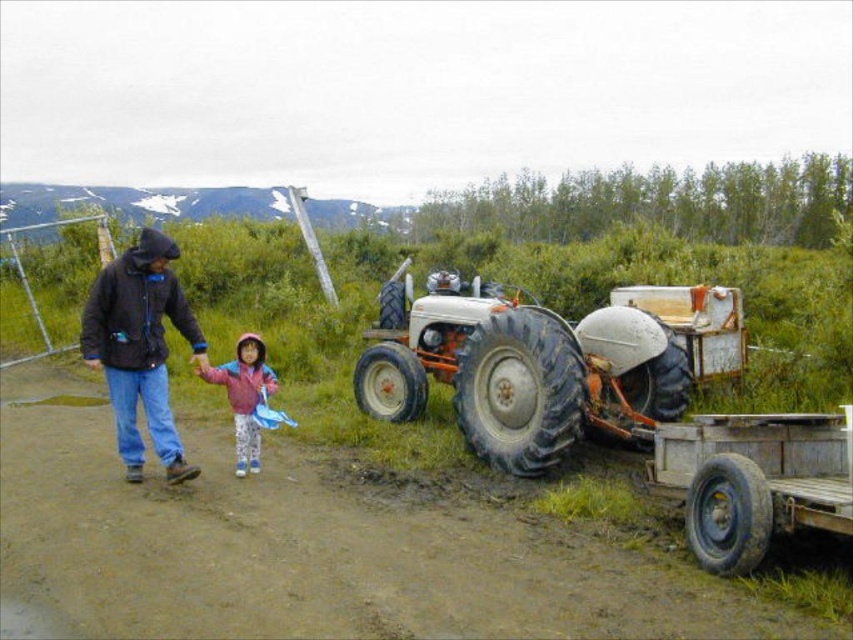
Between white rubber tractor at center and wooden trailer truck at lower right, which one is positioned higher?

white rubber tractor at center is above.

The image size is (853, 640). What do you see at coordinates (519, 369) in the screenshot? I see `white rubber tractor at center` at bounding box center [519, 369].

Does point (543, 467) come closer to viewer compared to point (735, 480)?

No, (543, 467) is further to viewer.

Identify the location of white rubber tractor at center. The height and width of the screenshot is (640, 853). (519, 369).

Between black matte jacket at left and red fleece jacket at center, which one appears on the right side from the viewer's perspective?

From the viewer's perspective, red fleece jacket at center appears more on the right side.

Find the location of `black matte jacket at left`. black matte jacket at left is located at coordinates (140, 348).

What do you see at coordinates (140, 348) in the screenshot?
I see `black matte jacket at left` at bounding box center [140, 348].

You are a GUI agent. You are given a task and a screenshot of the screen. Output one action in this format:
    pyautogui.click(x=<x>, y=<y>)
    Task: Click on the black matte jacket at left
    Image resolution: width=853 pixels, height=640 pixels.
    Given the screenshot: What is the action you would take?
    pyautogui.click(x=140, y=348)

Which is in front, point (672, 490) or point (244, 465)?

Point (672, 490) is in front.

Does wooden trailer truck at lower right have a lesser height compared to red fleece jacket at center?

Yes.

Between point (665, 460) and point (247, 353), which one is positioned in front?

Positioned in front is point (665, 460).

Find the location of a particular element. This screenshot has width=853, height=640. wooden trailer truck at lower right is located at coordinates (753, 481).